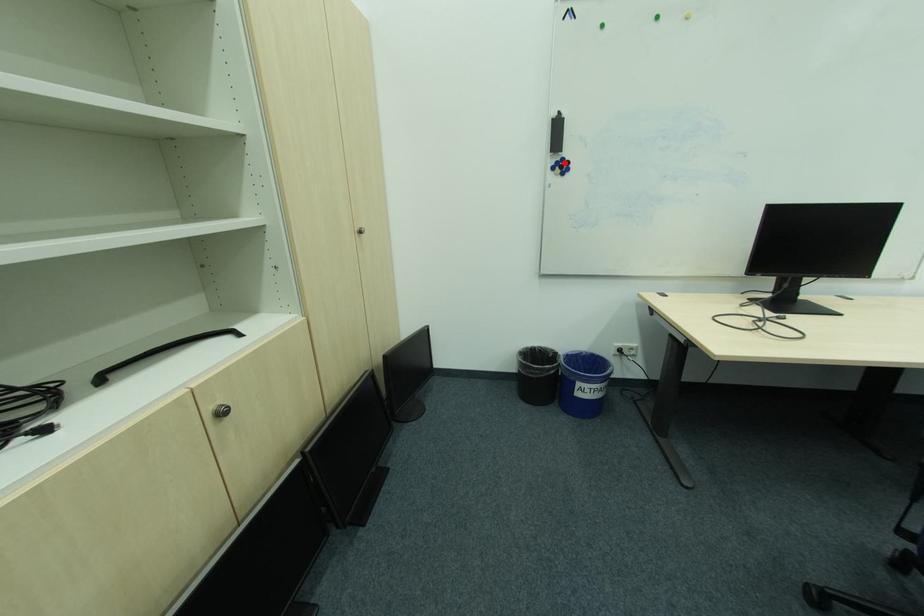
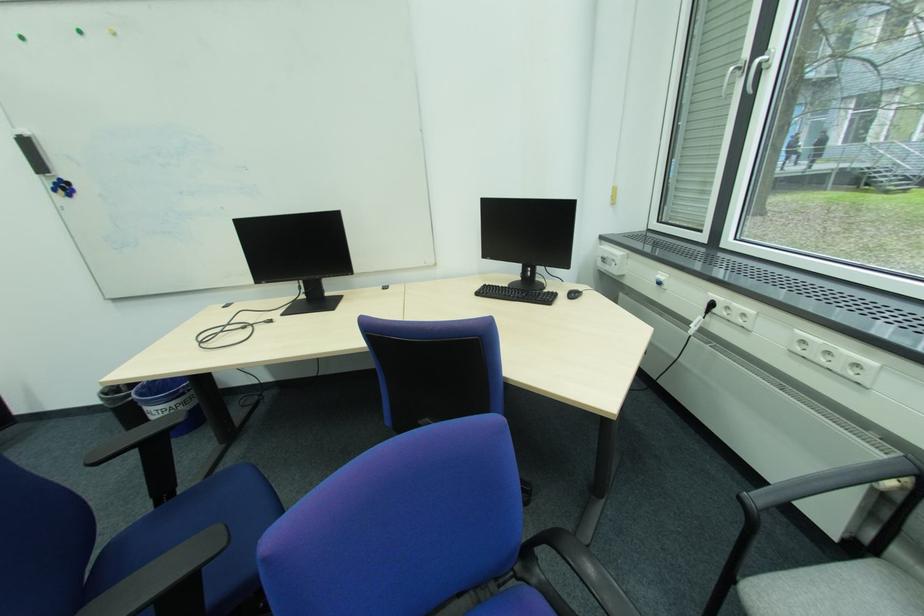
Find the pixel in the second image that matches the highlighted location in the first image.

(62, 185)